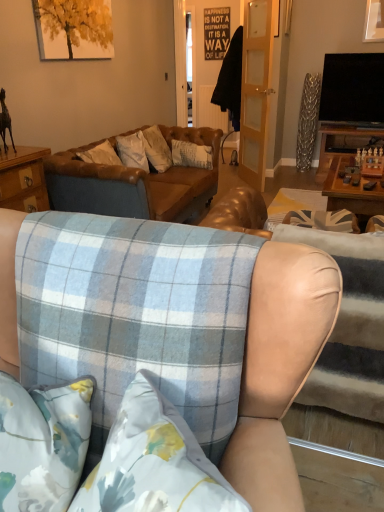
Question: Is blue plaid fabric at center, placed as the second studio couch when sorted from back to front, to the right of blue plaid fabric couch at center, positioned as the 1th studio couch in back-to-front order, from the viewer's perspective?

Choices:
 (A) yes
 (B) no

Answer: (A)

Question: Is blue plaid fabric at center, arranged as the 2th studio couch when viewed from the front, touching blue plaid fabric couch at center, which appears as the third studio couch when viewed from the front?

Choices:
 (A) no
 (B) yes

Answer: (A)

Question: From the image's perspective, does blue plaid fabric at center, arranged as the 2th studio couch when viewed from the front, appear higher than blue plaid fabric couch at center, which appears as the third studio couch when viewed from the front?

Choices:
 (A) no
 (B) yes

Answer: (A)

Question: Is blue plaid fabric couch at center, which appears as the third studio couch when viewed from the front, at the back of blue plaid fabric at center, arranged as the 2th studio couch when viewed from the front?

Choices:
 (A) no
 (B) yes

Answer: (A)

Question: Does blue plaid fabric at center, arranged as the 2th studio couch when viewed from the front, appear on the left side of blue plaid fabric couch at center, positioned as the 1th studio couch in back-to-front order?

Choices:
 (A) yes
 (B) no

Answer: (B)

Question: Can you confirm if blue plaid fabric at center, placed as the second studio couch when sorted from back to front, is smaller than blue plaid fabric couch at center, which appears as the third studio couch when viewed from the front?

Choices:
 (A) yes
 (B) no

Answer: (A)

Question: From the image's perspective, is blue plaid fabric at center, positioned as the third studio couch in back-to-front order, located above blue plaid fabric couch at center, positioned as the 1th studio couch in back-to-front order?

Choices:
 (A) no
 (B) yes

Answer: (A)

Question: Can you confirm if blue plaid fabric at center, positioned as the third studio couch in back-to-front order, is thinner than blue plaid fabric couch at center, positioned as the 1th studio couch in back-to-front order?

Choices:
 (A) yes
 (B) no

Answer: (A)

Question: Is blue plaid fabric at center, placed as the 1th studio couch when sorted from front to back, not close to blue plaid fabric couch at center, positioned as the 1th studio couch in back-to-front order?

Choices:
 (A) no
 (B) yes

Answer: (B)

Question: Can you confirm if blue plaid fabric at center, placed as the 1th studio couch when sorted from front to back, is shorter than blue plaid fabric couch at center, positioned as the 1th studio couch in back-to-front order?

Choices:
 (A) yes
 (B) no

Answer: (B)

Question: Would you say blue plaid fabric at center, placed as the 1th studio couch when sorted from front to back, is outside blue plaid fabric couch at center, positioned as the 1th studio couch in back-to-front order?

Choices:
 (A) no
 (B) yes

Answer: (B)

Question: From a real-world perspective, is blue plaid fabric at center, placed as the 1th studio couch when sorted from front to back, over blue plaid fabric couch at center, which appears as the third studio couch when viewed from the front?

Choices:
 (A) yes
 (B) no

Answer: (A)

Question: Is blue plaid fabric at center, placed as the second studio couch when sorted from back to front, oriented away from blue plaid fabric at center, placed as the 1th studio couch when sorted from front to back?

Choices:
 (A) no
 (B) yes

Answer: (B)